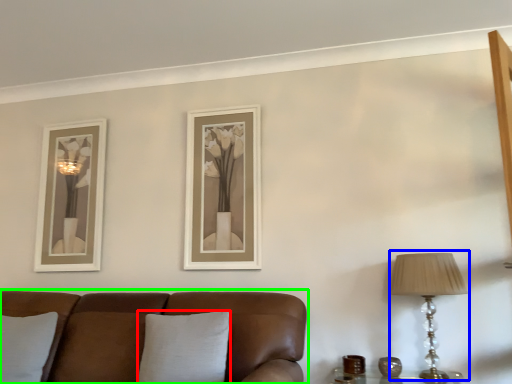
Question: Estimate the real-world distances between objects in this image. Which object is closer to pillow (highlighted by a red box), table lamp (highlighted by a blue box) or studio couch (highlighted by a green box)?

Choices:
 (A) table lamp
 (B) studio couch

Answer: (B)